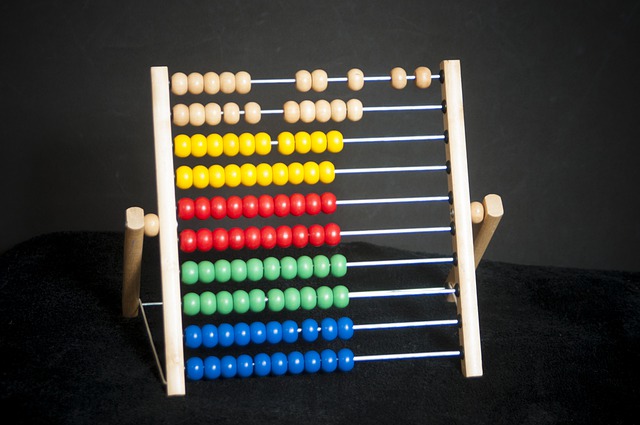
Locate an element on the screen. The width and height of the screenshot is (640, 425). metal abacus slider bars is located at coordinates (374, 75), (378, 107), (381, 139), (385, 168), (387, 198), (394, 229), (397, 262), (403, 291), (406, 322), (408, 353).